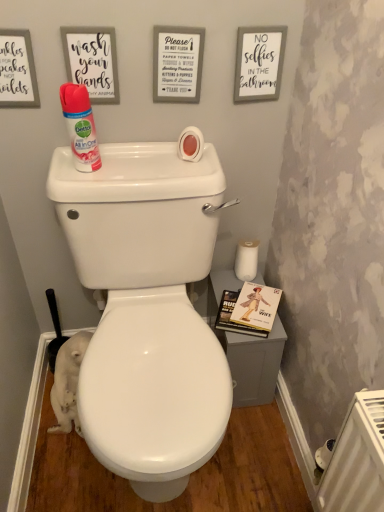
Question: From the image's perspective, is white fur cat at lower left located beneath matte pink spray can at upper left?

Choices:
 (A) no
 (B) yes

Answer: (B)

Question: Can you confirm if white fur cat at lower left is smaller than matte pink spray can at upper left?

Choices:
 (A) no
 (B) yes

Answer: (A)

Question: Is white fur cat at lower left completely or partially outside of matte pink spray can at upper left?

Choices:
 (A) no
 (B) yes

Answer: (B)

Question: From a real-world perspective, is white fur cat at lower left below matte pink spray can at upper left?

Choices:
 (A) yes
 (B) no

Answer: (A)

Question: Considering the relative sizes of white fur cat at lower left and matte pink spray can at upper left in the image provided, is white fur cat at lower left taller than matte pink spray can at upper left?

Choices:
 (A) yes
 (B) no

Answer: (A)

Question: Relative to matte pink spray can at upper left, is white fur cat at lower left in front or behind?

Choices:
 (A) behind
 (B) front

Answer: (A)

Question: Does point (79, 364) appear closer or farther from the camera than point (74, 122)?

Choices:
 (A) farther
 (B) closer

Answer: (A)

Question: From a real-world perspective, is white fur cat at lower left positioned above or below matte pink spray can at upper left?

Choices:
 (A) below
 (B) above

Answer: (A)

Question: From the image's perspective, is white fur cat at lower left located above or below matte pink spray can at upper left?

Choices:
 (A) above
 (B) below

Answer: (B)

Question: Is matte white sign at upper left, the 3th copy from the right, inside or outside of white paper sign at upper center, marked as the second copy in a right-to-left arrangement?

Choices:
 (A) inside
 (B) outside

Answer: (B)

Question: From the image's perspective, is matte white sign at upper left, the 3th copy from the right, positioned above or below white paper sign at upper center, marked as the second copy in a right-to-left arrangement?

Choices:
 (A) above
 (B) below

Answer: (B)

Question: Is point (81, 44) positioned closer to the camera than point (185, 68)?

Choices:
 (A) farther
 (B) closer

Answer: (B)

Question: Looking at the image, does matte white sign at upper left, the 2th copy positioned from the left, seem bigger or smaller compared to white paper sign at upper center, the third copy viewed from the left?

Choices:
 (A) small
 (B) big

Answer: (A)

Question: Visually, is white paper sign at upper center, marked as the second copy in a right-to-left arrangement, positioned to the left or to the right of white matte sign at upper right, which is the first copy in right-to-left order?

Choices:
 (A) right
 (B) left

Answer: (B)

Question: Choose the correct answer: Is white paper sign at upper center, the third copy viewed from the left, inside white matte sign at upper right, which is the first copy in right-to-left order, or outside it?

Choices:
 (A) inside
 (B) outside

Answer: (B)